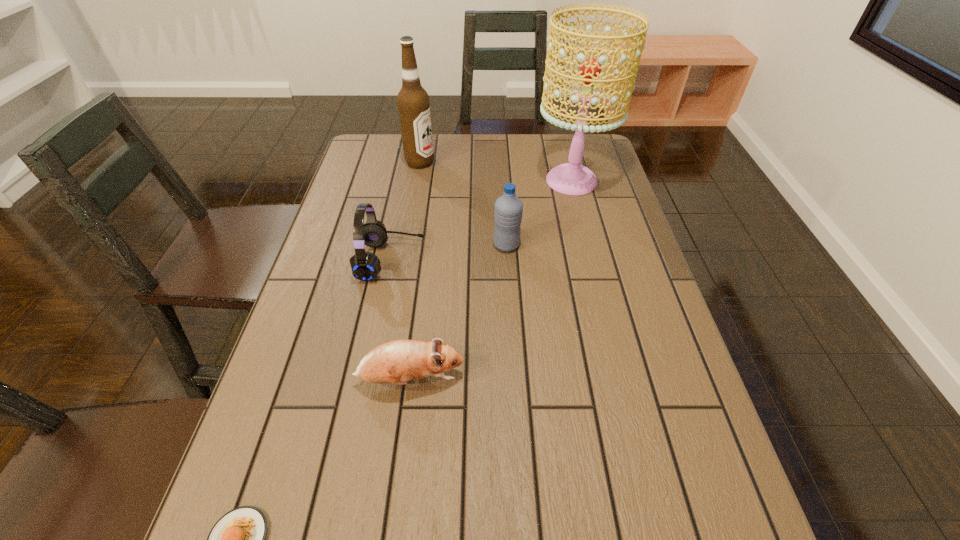
This screenshot has width=960, height=540. I want to click on vacant space situated 0.280m on the ear cushions of the headset, so click(532, 260).

Where is `vacant space positioned at the face of the hamster`? The image size is (960, 540). vacant space positioned at the face of the hamster is located at coordinates (642, 380).

Identify the location of lampshade that is at the far edge. The image size is (960, 540). (571, 178).

The height and width of the screenshot is (540, 960). Identify the location of alcohol located at the far edge. (413, 103).

Locate an element on the screen. The image size is (960, 540). object present at the left edge is located at coordinates (365, 266).

This screenshot has height=540, width=960. I want to click on object at the right edge, so click(571, 178).

Locate an element on the screen. object that is at the far right corner is located at coordinates (571, 178).

I want to click on free space at the far edge of the desktop, so click(485, 154).

In the image, there is a desktop. In order to click on vacant space at the left edge in this screenshot , I will do `click(309, 300)`.

This screenshot has width=960, height=540. Identify the location of vacant area at the far right corner of the desktop. (586, 146).